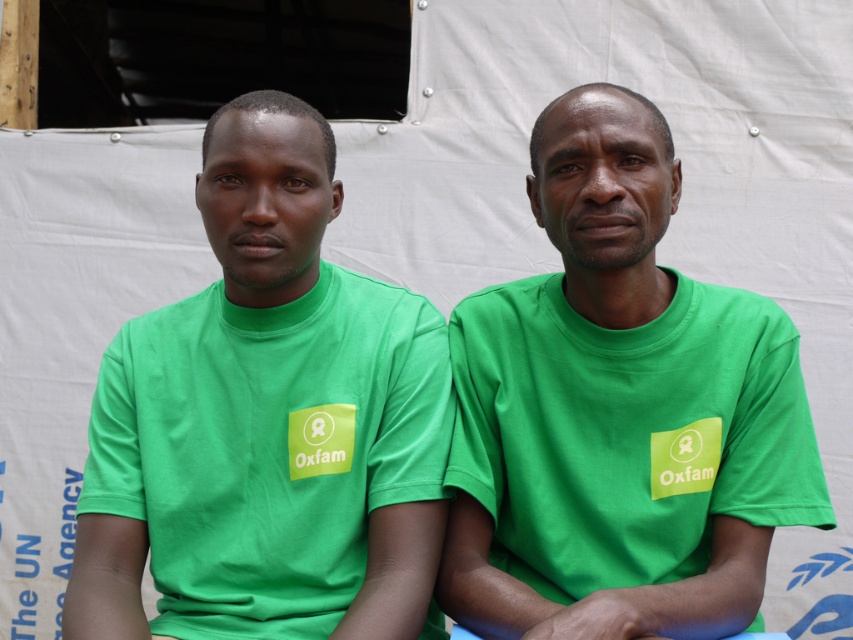
Question: Is green matte t-shirt at center further to camera compared to green fabric shirt at center?

Choices:
 (A) no
 (B) yes

Answer: (A)

Question: Which point is closer to the camera taking this photo?

Choices:
 (A) (721, 557)
 (B) (404, 426)

Answer: (A)

Question: Is green matte t-shirt at center in front of green fabric shirt at center?

Choices:
 (A) yes
 (B) no

Answer: (A)

Question: Can you confirm if green matte t-shirt at center is positioned above green fabric shirt at center?

Choices:
 (A) no
 (B) yes

Answer: (B)

Question: Which point is farther from the camera taking this photo?

Choices:
 (A) (485, 381)
 (B) (281, 502)

Answer: (A)

Question: Which point appears closest to the camera in this image?

Choices:
 (A) (383, 412)
 (B) (520, 388)

Answer: (A)